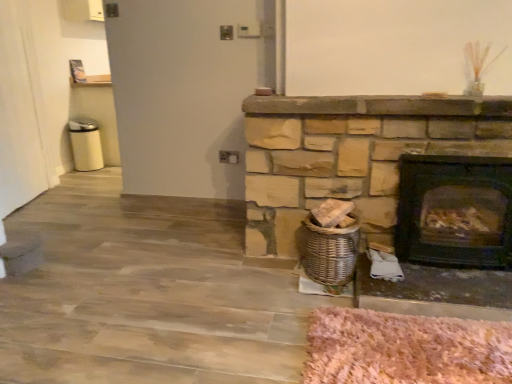
Question: Considering the relative positions of woven brown basket at lower center and black matte wood burning stove at right in the image provided, is woven brown basket at lower center behind black matte wood burning stove at right?

Choices:
 (A) no
 (B) yes

Answer: (B)

Question: Is woven brown basket at lower center oriented towards black matte wood burning stove at right?

Choices:
 (A) no
 (B) yes

Answer: (A)

Question: Is woven brown basket at lower center at the right side of black matte wood burning stove at right?

Choices:
 (A) yes
 (B) no

Answer: (B)

Question: Is woven brown basket at lower center looking in the opposite direction of black matte wood burning stove at right?

Choices:
 (A) yes
 (B) no

Answer: (B)

Question: Does woven brown basket at lower center have a lesser width compared to black matte wood burning stove at right?

Choices:
 (A) no
 (B) yes

Answer: (A)

Question: Does woven brown basket at lower center contain black matte wood burning stove at right?

Choices:
 (A) no
 (B) yes

Answer: (A)

Question: Could you tell me if black matte wood burning stove at right is facing woven brown basket at lower center?

Choices:
 (A) no
 (B) yes

Answer: (A)

Question: Is woven brown basket at lower center inside black matte wood burning stove at right?

Choices:
 (A) yes
 (B) no

Answer: (B)

Question: Is black matte wood burning stove at right smaller than woven brown basket at lower center?

Choices:
 (A) no
 (B) yes

Answer: (A)

Question: Does black matte wood burning stove at right have a greater height compared to woven brown basket at lower center?

Choices:
 (A) no
 (B) yes

Answer: (B)

Question: Is black matte wood burning stove at right bigger than woven brown basket at lower center?

Choices:
 (A) yes
 (B) no

Answer: (A)

Question: Is the depth of black matte wood burning stove at right less than that of woven brown basket at lower center?

Choices:
 (A) yes
 (B) no

Answer: (A)

Question: Based on their sizes in the image, would you say black matte wood burning stove at right is bigger or smaller than woven brown basket at lower center?

Choices:
 (A) big
 (B) small

Answer: (A)